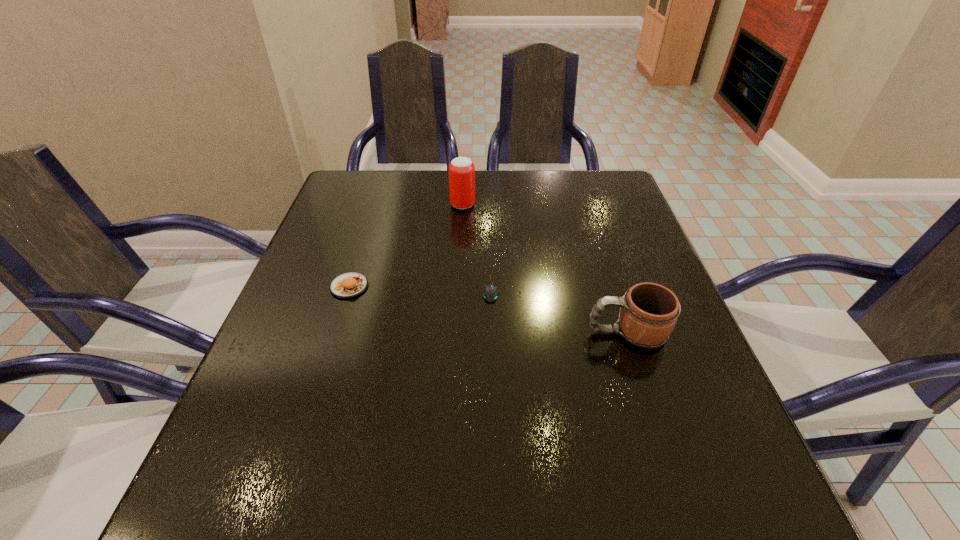
Where is `free space between the third object from left to right and the second tallest object`? free space between the third object from left to right and the second tallest object is located at coordinates (560, 309).

Where is `free space between the second shortest object and the farthest object`? free space between the second shortest object and the farthest object is located at coordinates [x=406, y=246].

Locate which object is the closest to the tallest object. Please provide its 2D coordinates. Your answer should be formatted as a tuple, i.e. [(x, y)], where the tuple contains the x and y coordinates of a point satisfying the conditions above.

[(490, 294)]

Locate which object is the third closest to the mouse. Please provide its 2D coordinates. Your answer should be formatted as a tuple, i.e. [(x, y)], where the tuple contains the x and y coordinates of a point satisfying the conditions above.

[(351, 284)]

Image resolution: width=960 pixels, height=540 pixels. Find the location of `vacant space that satisfies the following two spatial constraints: 1. on the back side of the leftmost object; 2. on the left side of the mouse`. vacant space that satisfies the following two spatial constraints: 1. on the back side of the leftmost object; 2. on the left side of the mouse is located at coordinates (349, 285).